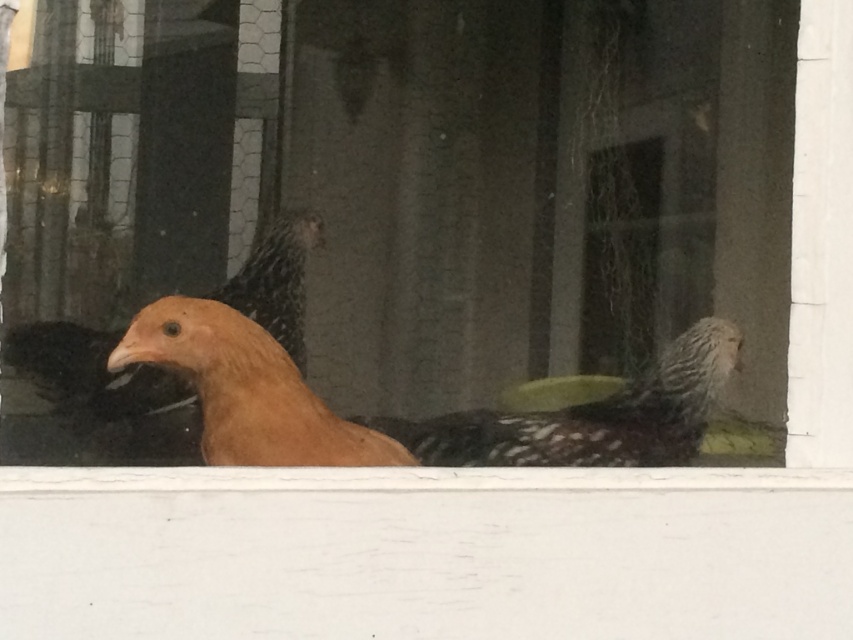
You are standing outside looking through the window at the two chickens. Which chicken, the matte orange chicken at center or the golden feathered chicken at center, is positioned higher in the image?

The matte orange chicken at center is positioned higher in the image than the golden feathered chicken at center because it is located above it according to the description.

You are an ornithologist observing two birds through a frosted glass window. You notice a matte orange chicken at center and a matte orange bird at center. Which of these two has a taller stature?

The matte orange chicken at center has a greater height compared to the matte orange bird at center, so the matte orange chicken at center is taller.

You are standing in a room with a window. You see a golden feathered chicken at center. If you want to touch the chicken through the window, where should you aim your hand relative to the window?

The golden feathered chicken at center is located at point (247,390) on the window, so you should aim your hand at that coordinate to reach it.